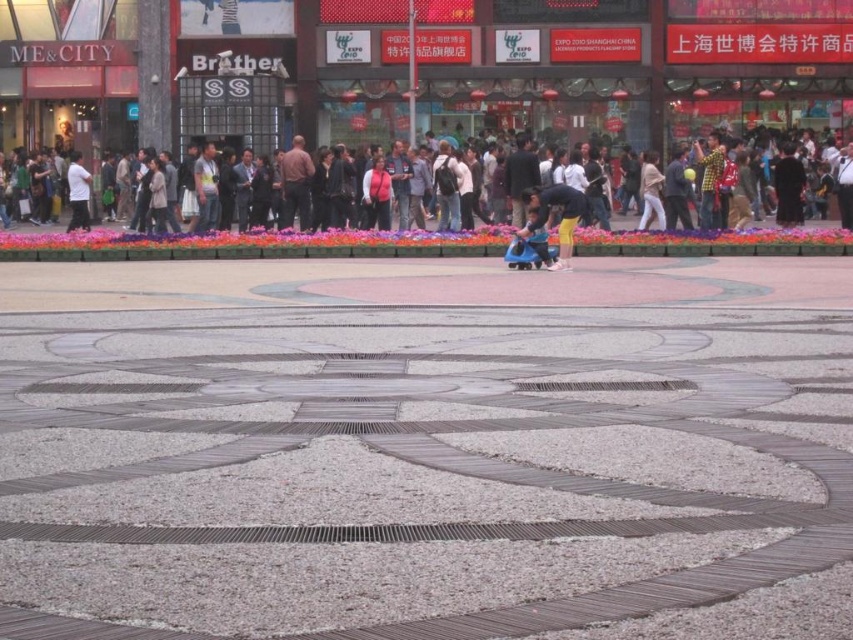
Does white gravel at center appear on the left side of white matte shirt at left?

No, white gravel at center is not to the left of white matte shirt at left.

Does white gravel at center appear under white matte shirt at left?

Correct, white gravel at center is located below white matte shirt at left.

Where is `white gravel at center`? white gravel at center is located at coordinates coord(412,468).

Find the location of a particular element. The height and width of the screenshot is (640, 853). matte glass mall at upper center is located at coordinates (631, 65).

The image size is (853, 640). Describe the element at coordinates (631, 65) in the screenshot. I see `matte glass mall at upper center` at that location.

Between point (585, 131) and point (660, 228), which one is positioned in front?

Point (660, 228)

Locate an element on the screen. matte glass mall at upper center is located at coordinates (631, 65).

What do you see at coordinates (788, 186) in the screenshot?
I see `black matte person at right` at bounding box center [788, 186].

Is black matte person at right behind light beige sweater at center?

That is True.

This screenshot has width=853, height=640. Describe the element at coordinates (788, 186) in the screenshot. I see `black matte person at right` at that location.

Locate an element on the screen. This screenshot has width=853, height=640. black matte person at right is located at coordinates (788, 186).